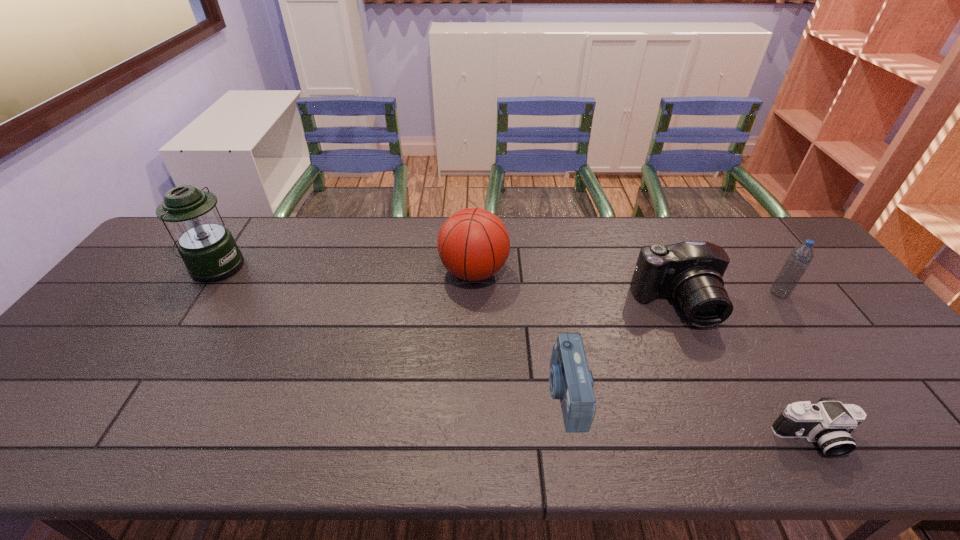
In the image, there is a desktop. Identify the location of vacant space at the near edge. This screenshot has width=960, height=540. (141, 459).

The height and width of the screenshot is (540, 960). Identify the location of free space at the left edge of the desktop. (84, 326).

Image resolution: width=960 pixels, height=540 pixels. I want to click on free point at the right edge, so click(810, 278).

Identify the location of free spot at the far right corner of the desktop. Image resolution: width=960 pixels, height=540 pixels. (746, 231).

Find the location of `free spot between the leftmost camera and the water bottle`. free spot between the leftmost camera and the water bottle is located at coordinates point(673,343).

The image size is (960, 540). In order to click on free space between the fourth object from right to left and the lantern in this screenshot , I will do `click(391, 330)`.

Where is `free spot between the second object from left to right and the tallest camera`? The image size is (960, 540). free spot between the second object from left to right and the tallest camera is located at coordinates pyautogui.click(x=575, y=289).

The height and width of the screenshot is (540, 960). What are the coordinates of `free spot between the water bottle and the basketball` in the screenshot? It's located at (627, 283).

You are a GUI agent. You are given a task and a screenshot of the screen. Output one action in this format:
    pyautogui.click(x=<x>, y=<y>)
    Task: Click on the free space that is in between the third shortest object and the lantern
    
    Given the screenshot: What is the action you would take?
    pyautogui.click(x=446, y=286)

Where is `free space between the leftmost camera and the tallest camera`? This screenshot has height=540, width=960. free space between the leftmost camera and the tallest camera is located at coordinates coord(621,349).